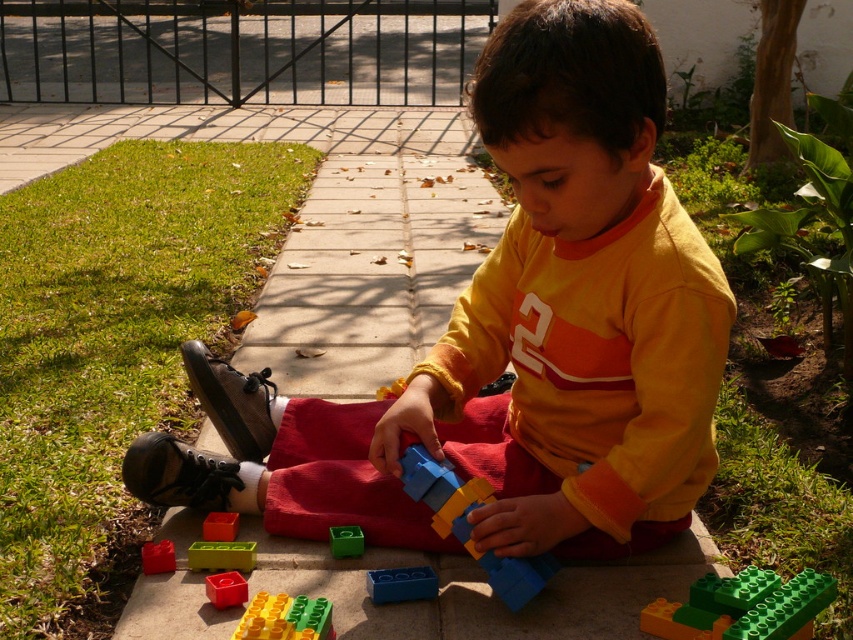
Question: Which point is closer to the camera?

Choices:
 (A) (722, 595)
 (B) (163, 540)

Answer: (A)

Question: Which object is farther from the camera taking this photo?

Choices:
 (A) matte plastic blocks at center
 (B) blue plastic blocks at center

Answer: (B)

Question: Where is green plastic blocks at lower center located in relation to blue plastic brick at center in the image?

Choices:
 (A) left
 (B) right

Answer: (B)

Question: Which object is closer to the camera taking this photo?

Choices:
 (A) bright yellow plastic blocks at lower center
 (B) green plastic blocks at lower center
 (C) translucent plastic brick at lower center

Answer: (B)

Question: Can you confirm if bright yellow plastic blocks at lower center is positioned to the right of translucent green plastic blocks at lower center?

Choices:
 (A) yes
 (B) no

Answer: (A)

Question: Can you confirm if blue plastic brick at center is positioned above green plastic block at center?

Choices:
 (A) no
 (B) yes

Answer: (A)